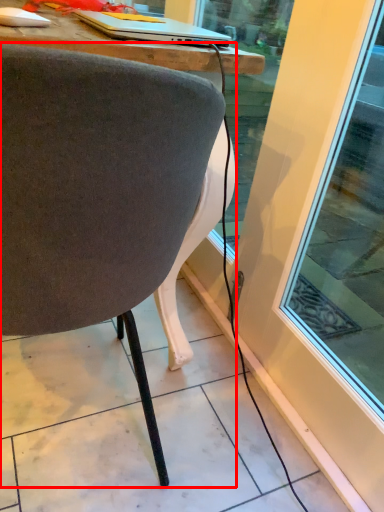
Question: From the image's perspective, where is chair (annotated by the red box) located in relation to laptop in the image?

Choices:
 (A) above
 (B) below

Answer: (B)